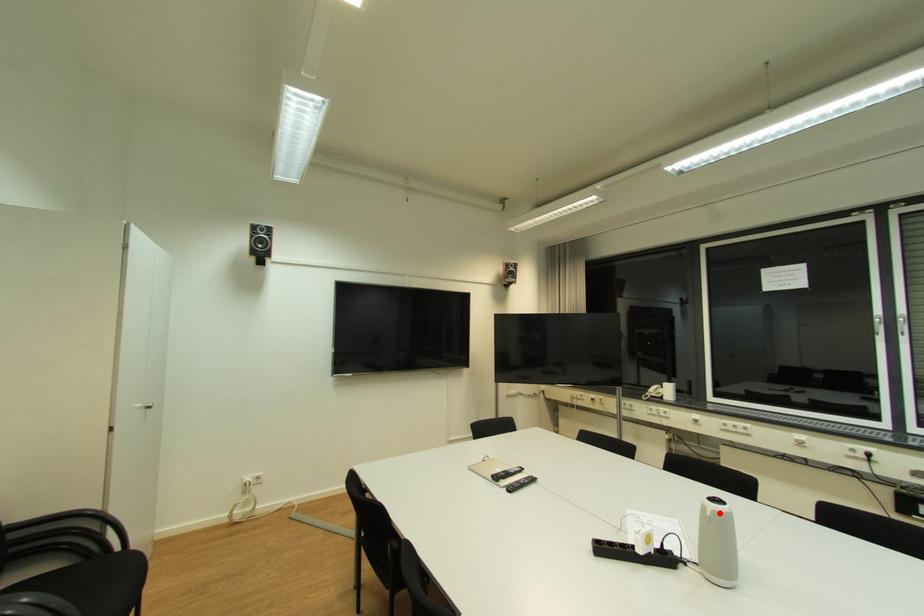
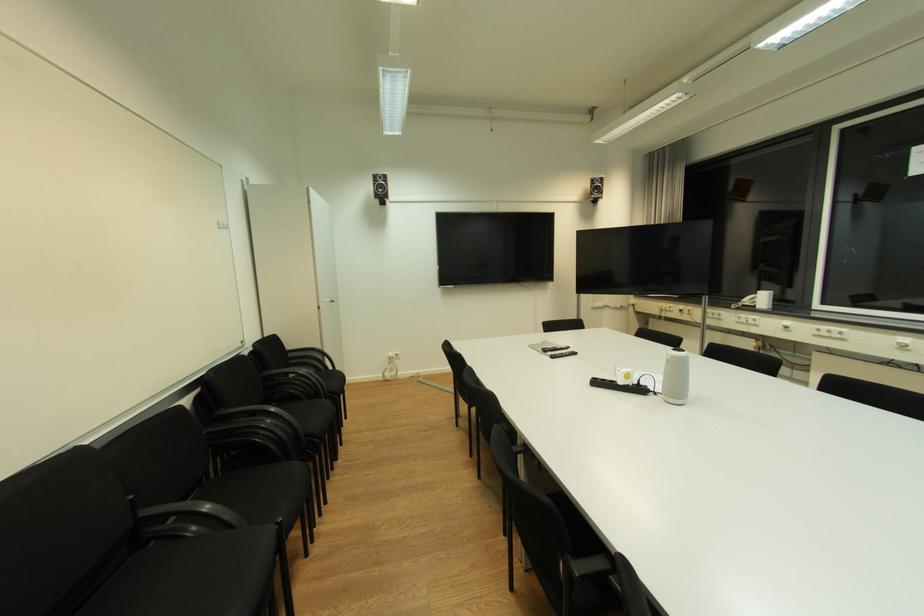
Find the pixel in the second image that matches the highlighted location in the first image.

(678, 358)